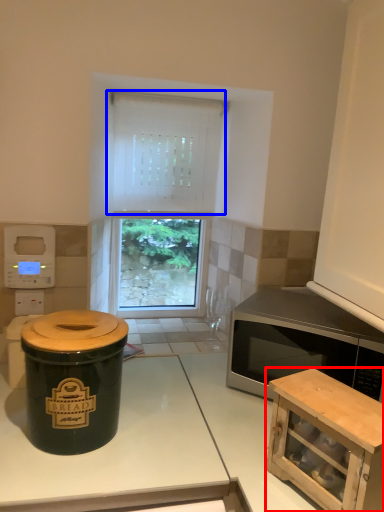
Question: Which of the following is the closest to the observer, cabinetry (highlighted by a red box) or curtain (highlighted by a blue box)?

Choices:
 (A) cabinetry
 (B) curtain

Answer: (A)